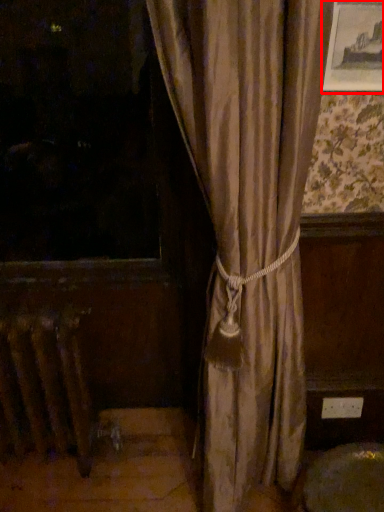
Question: Observing the image, what is the correct spatial positioning of picture frame (annotated by the red box) in reference to radiator?

Choices:
 (A) right
 (B) left

Answer: (A)